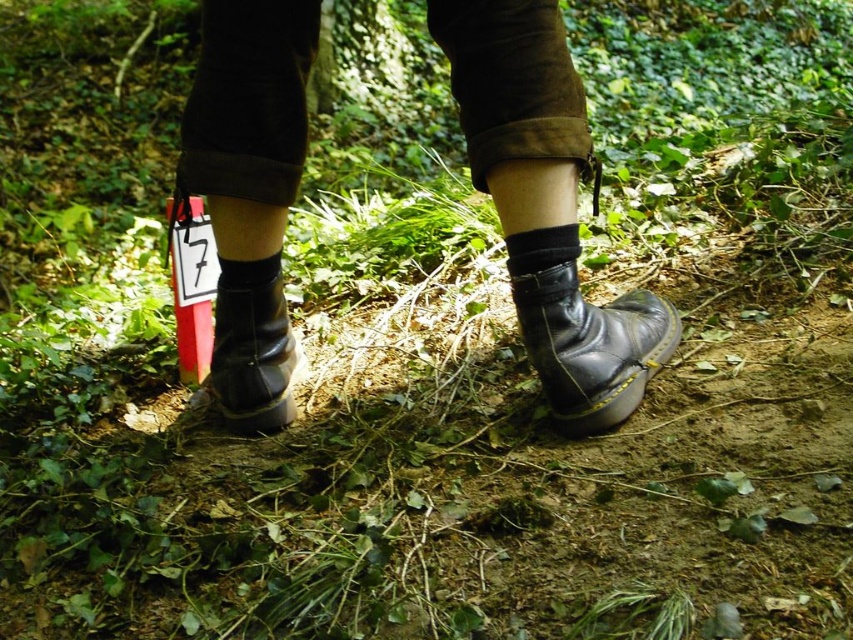
You are a photographer trying to capture the details of both the black leather boots at center and the black leather hiking boot at lower left. Since you want to focus on the closest object first, which boot should you adjust your camera to focus on?

The black leather boots at center is closer to the viewer than the black leather hiking boot at lower left, so you should focus on the black leather boots at center first.

Consider the image. You are a photographer trying to capture a detailed shot of the black leather boots at center. Your camera has a minimum focusing distance of 1 meter. Can you take the photo without moving closer than 1 meter?

The black leather boots at center is 99.41 centimeters from camera, which is less than 1 meter. Therefore, the camera cannot focus on the black leather boots at center as it is too close.